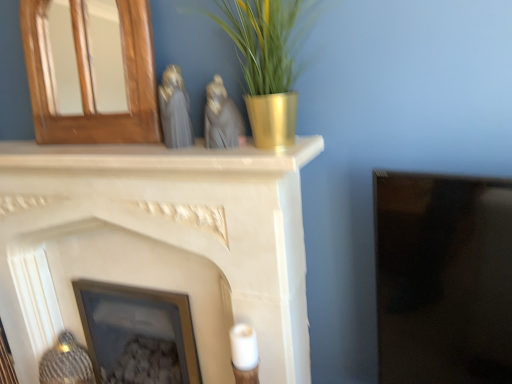
Question: Is there a large distance between matte gray statue at center, which is the 1th animal in right-to-left order, and wooden mirror at upper left, the 2th fireplace ordered from the bottom?

Choices:
 (A) no
 (B) yes

Answer: (A)

Question: Is matte gray statue at center, which is the 1th animal in right-to-left order, aimed at wooden mirror at upper left, the 2th fireplace ordered from the bottom?

Choices:
 (A) no
 (B) yes

Answer: (A)

Question: Can you confirm if matte gray statue at center, the 2th animal positioned from the left, is smaller than wooden mirror at upper left, which appears as the 1th fireplace when viewed from the top?

Choices:
 (A) yes
 (B) no

Answer: (A)

Question: Is wooden mirror at upper left, which appears as the 1th fireplace when viewed from the top, surrounded by matte gray statue at center, the 2th animal positioned from the left?

Choices:
 (A) yes
 (B) no

Answer: (B)

Question: Does matte gray statue at center, which is the 1th animal in right-to-left order, have a greater height compared to wooden mirror at upper left, the 2th fireplace ordered from the bottom?

Choices:
 (A) yes
 (B) no

Answer: (B)

Question: Does matte gray statue at center, which is the 1th animal in right-to-left order, appear on the left side of wooden mirror at upper left, the 2th fireplace ordered from the bottom?

Choices:
 (A) yes
 (B) no

Answer: (B)

Question: Considering the relative positions of satin gray statue at center, the 1th animal in the left-to-right sequence, and matte glass picture frame at center in the image provided, is satin gray statue at center, the 1th animal in the left-to-right sequence, in front of matte glass picture frame at center?

Choices:
 (A) no
 (B) yes

Answer: (B)

Question: Considering the relative positions of satin gray statue at center, the 1th animal in the left-to-right sequence, and matte glass picture frame at center in the image provided, is satin gray statue at center, the 1th animal in the left-to-right sequence, to the right of matte glass picture frame at center from the viewer's perspective?

Choices:
 (A) yes
 (B) no

Answer: (A)

Question: Are satin gray statue at center, which appears as the 2th animal when viewed from the right, and matte glass picture frame at center making contact?

Choices:
 (A) yes
 (B) no

Answer: (B)

Question: From the image's perspective, is satin gray statue at center, which appears as the 2th animal when viewed from the right, over matte glass picture frame at center?

Choices:
 (A) yes
 (B) no

Answer: (A)

Question: Is satin gray statue at center, the 1th animal in the left-to-right sequence, positioned behind matte glass picture frame at center?

Choices:
 (A) no
 (B) yes

Answer: (A)

Question: Can you confirm if satin gray statue at center, which appears as the 2th animal when viewed from the right, is smaller than matte glass picture frame at center?

Choices:
 (A) yes
 (B) no

Answer: (A)

Question: Does wooden mirror at upper left, the 2th fireplace ordered from the bottom, appear on the left side of matte gray statue at center, which is the 1th animal in right-to-left order?

Choices:
 (A) yes
 (B) no

Answer: (A)